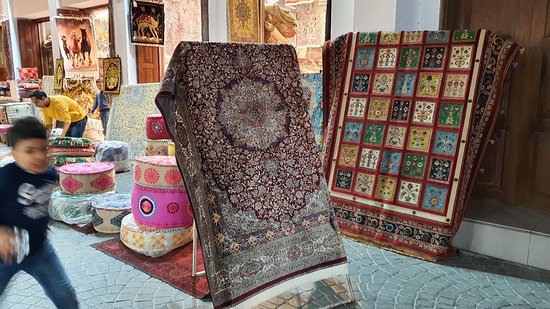
The height and width of the screenshot is (309, 550). In order to click on door in this screenshot , I will do (146, 63).